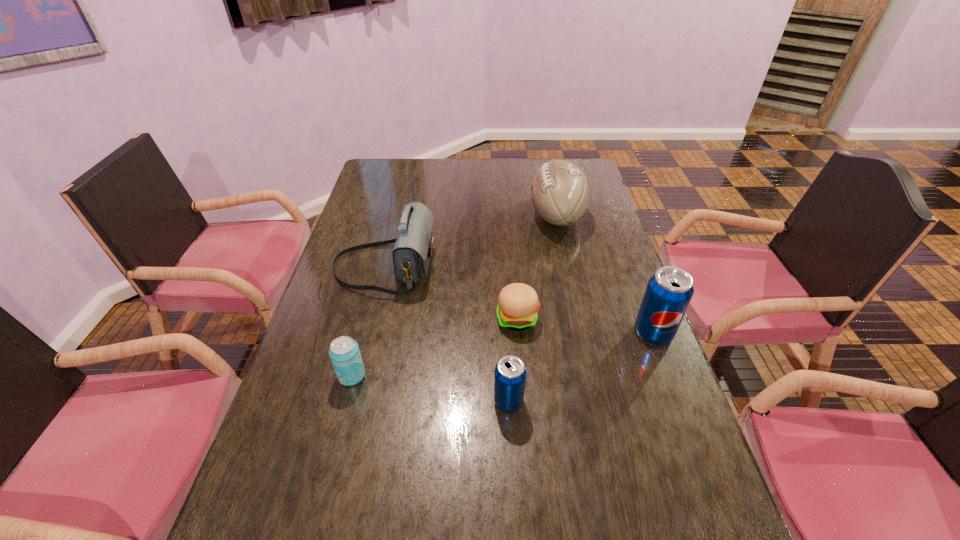
Where is `the shorter pop soda`? Image resolution: width=960 pixels, height=540 pixels. the shorter pop soda is located at coordinates (510, 373).

What are the coordinates of `the nearest object` in the screenshot? It's located at (510, 373).

Locate an element on the screen. the rightmost object is located at coordinates (669, 291).

Image resolution: width=960 pixels, height=540 pixels. What are the coordinates of `the right pop soda` in the screenshot? It's located at (669, 291).

Find the location of a particular element. This screenshot has width=960, height=540. the second object from right to left is located at coordinates (559, 192).

At what (x,y) coordinates should I click in order to perform the action: click on shoulder bag. Please return your answer as a coordinate pair (x, y). Looking at the image, I should click on (411, 254).

Find the location of a particular element. This screenshot has height=540, width=960. hamburger is located at coordinates (518, 303).

This screenshot has width=960, height=540. In order to click on beer can in this screenshot , I will do `click(344, 352)`.

Find the location of a particular element. free point located 0.180m on the front of the shorter pop soda is located at coordinates (514, 498).

You are a GUI agent. You are given a task and a screenshot of the screen. Output one action in this format:
    pyautogui.click(x=<x>, y=<y>)
    Task: Click on the blank space located 0.390m on the left of the rightmost object
    This screenshot has height=540, width=960.
    Given the screenshot: What is the action you would take?
    pyautogui.click(x=485, y=333)